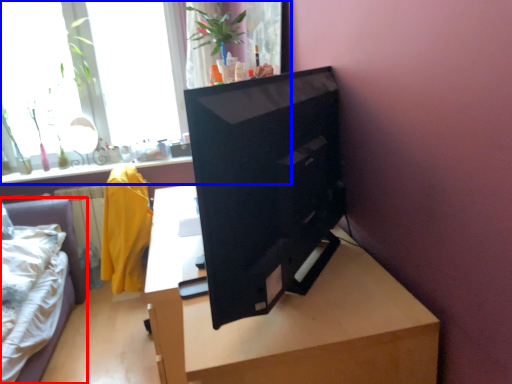
Question: Which point is further to the camera, furniture (highlighted by a red box) or window (highlighted by a blue box)?

Choices:
 (A) furniture
 (B) window

Answer: (B)